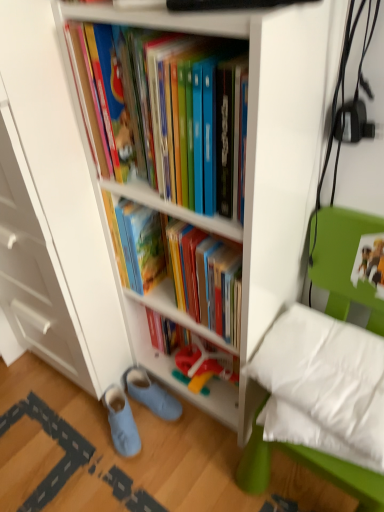
Question: From a real-world perspective, does white glossy bookcase at center sit lower than matte plastic books at center, the 1th book positioned from the top?

Choices:
 (A) yes
 (B) no

Answer: (A)

Question: Is matte plastic books at center, the 1th book positioned from the top, surrounded by white glossy bookcase at center?

Choices:
 (A) no
 (B) yes

Answer: (B)

Question: Is there a large distance between white glossy bookcase at center and matte plastic books at center, the 1th book positioned from the top?

Choices:
 (A) yes
 (B) no

Answer: (B)

Question: From the image's perspective, is white glossy bookcase at center above matte plastic books at center, the 1th book positioned from the top?

Choices:
 (A) yes
 (B) no

Answer: (B)

Question: From a real-world perspective, does white glossy bookcase at center stand above matte plastic books at center, the 1th book positioned from the top?

Choices:
 (A) no
 (B) yes

Answer: (A)

Question: Is white glossy bookcase at center to the left of matte plastic books at center, the second book ordered from the bottom, from the viewer's perspective?

Choices:
 (A) yes
 (B) no

Answer: (B)

Question: Can you confirm if white soft pillow at lower right is wider than matte plastic shelf at center?

Choices:
 (A) no
 (B) yes

Answer: (B)

Question: Can you see white soft pillow at lower right touching matte plastic shelf at center?

Choices:
 (A) no
 (B) yes

Answer: (A)

Question: Considering the relative positions of white soft pillow at lower right and matte plastic shelf at center in the image provided, is white soft pillow at lower right to the right of matte plastic shelf at center from the viewer's perspective?

Choices:
 (A) no
 (B) yes

Answer: (B)

Question: Is white soft pillow at lower right smaller than matte plastic shelf at center?

Choices:
 (A) yes
 (B) no

Answer: (A)

Question: Is the position of white soft pillow at lower right more distant than that of matte plastic shelf at center?

Choices:
 (A) no
 (B) yes

Answer: (A)

Question: Is white soft pillow at lower right outside of matte plastic shelf at center?

Choices:
 (A) no
 (B) yes

Answer: (B)

Question: Considering the relative sizes of white soft pillow at lower right and light blue fabric slippers at lower left, the 2th footwear when ordered from right to left, in the image provided, is white soft pillow at lower right shorter than light blue fabric slippers at lower left, the 2th footwear when ordered from right to left,?

Choices:
 (A) yes
 (B) no

Answer: (B)